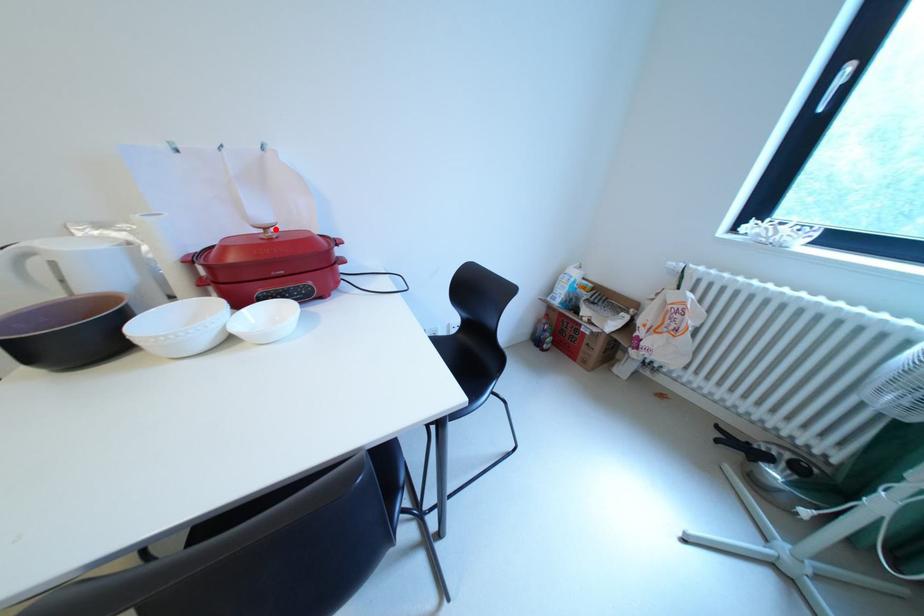
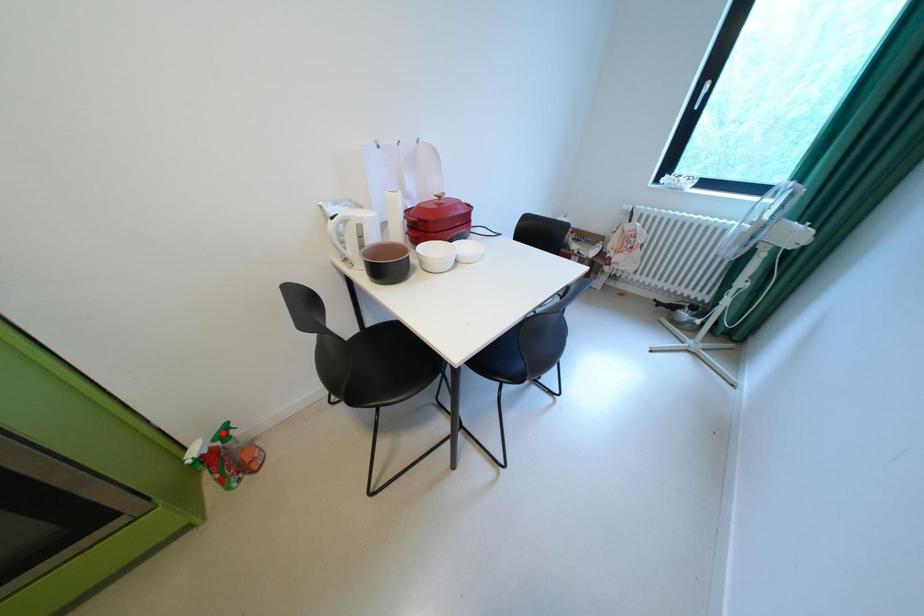
I am providing you with two images of the same scene from different viewpoints. A red point is marked on the first image and another point is marked on the second image. Do the highlighted points in image1 and image2 indicate the same real-world spot?

No